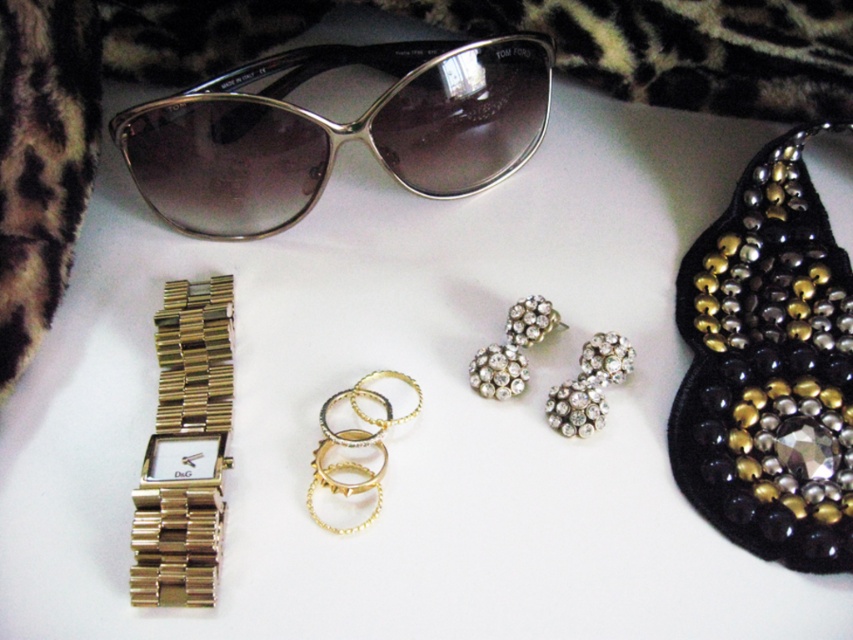
You are a jewelry designer who needs to place the gold metallic watch at upper left and the clear crystal earrings at center into a display case. The case has a width of 10 cm. Can both items fit side by side without overlapping?

The gold metallic watch at upper left has a lesser width compared to the clear crystal earrings at center. However, without knowing the exact widths of both items, it is impossible to determine if their combined width exceeds 10 cm. Additional measurements are required.

You are a jewelry designer examining the arrangement of accessories. You need to determine which object is closer to you between the gold metallic watch at upper left and the clear crystal earrings at center. Which one is closer?

The gold metallic watch at upper left is closer to you because it is in front of the clear crystal earrings at center.

Based on the photo, you are a customer in a store and see two points marked on the image of accessories. The first point is at coordinate point (x=518, y=154) and the second is at point (x=154, y=509). Which point is closer to you?

Point (x=154, y=509) is closer to you because point (x=518, y=154) is behind it.